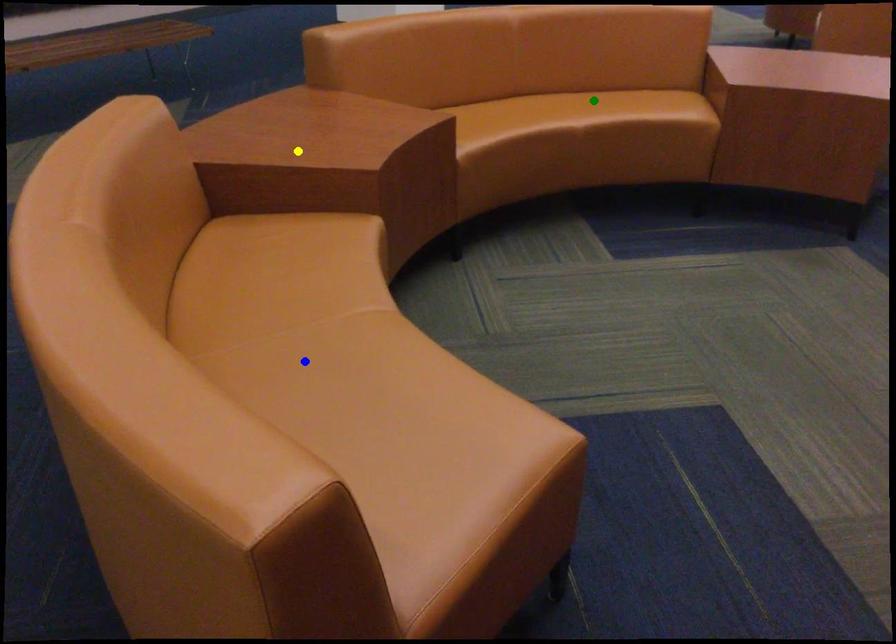
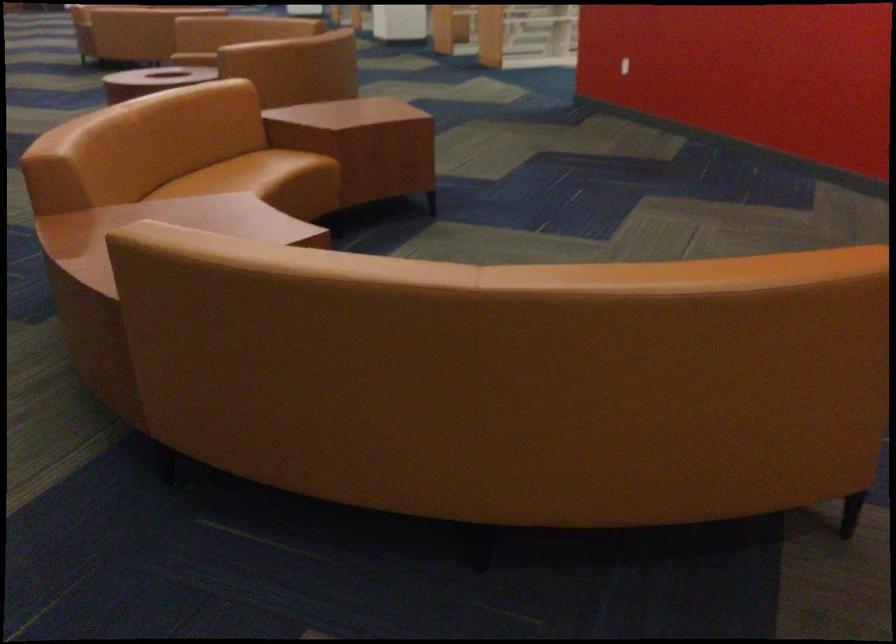
I am providing you with two images of the same scene from different viewpoints. Three points are marked in image1. Which point corresponds to a part or object that is occluded in image2?In image1, three points are marked. Which of them correspond to a part or object that is occluded in image2?Among the three points shown in image1, which one corresponds to a part or object that is no longer visible due to occlusion in image2?

Invisible in image2: blue point, yellow point.